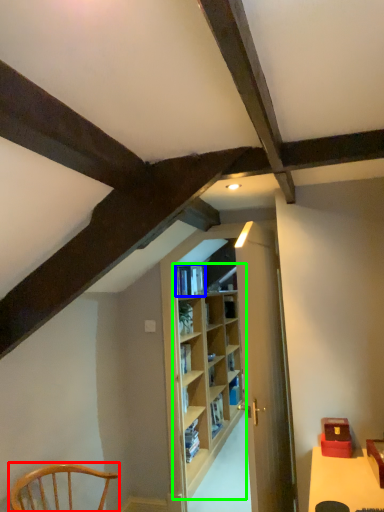
Question: Based on their relative distances, which object is farther from chair (highlighted by a red box)? Choose from book (highlighted by a blue box) and shelf (highlighted by a green box).

Choices:
 (A) book
 (B) shelf

Answer: (B)